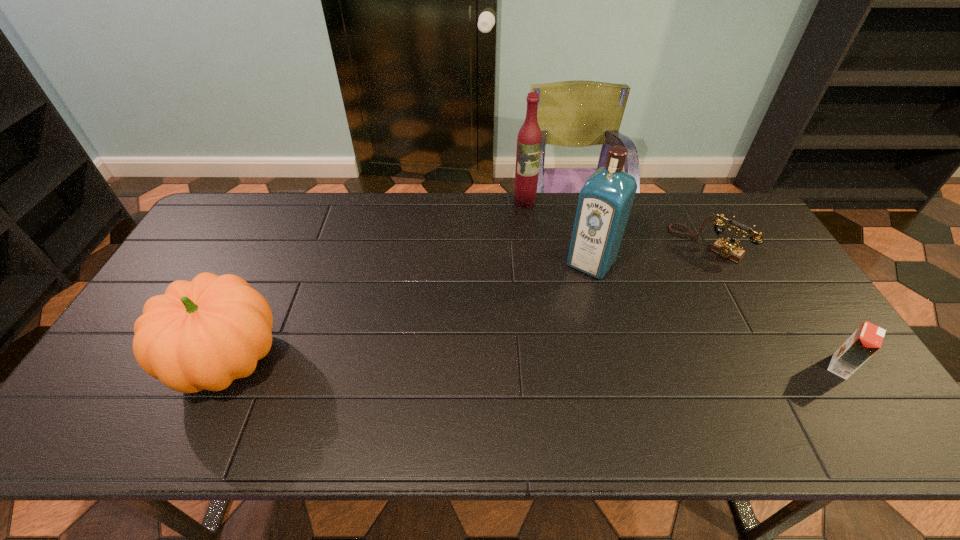
I want to click on vacant area that lies between the orange juice and the third shortest object, so click(x=534, y=363).

What are the coordinates of `the fourth closest object to the orange juice` in the screenshot? It's located at (202, 334).

Identify the location of the closest object to the fourth object from left to right. The width and height of the screenshot is (960, 540). (605, 201).

Where is `vacant region that satisfies the following two spatial constraints: 1. on the back side of the left liquor; 2. on the right side of the third shortest object`? vacant region that satisfies the following two spatial constraints: 1. on the back side of the left liquor; 2. on the right side of the third shortest object is located at coordinates (302, 201).